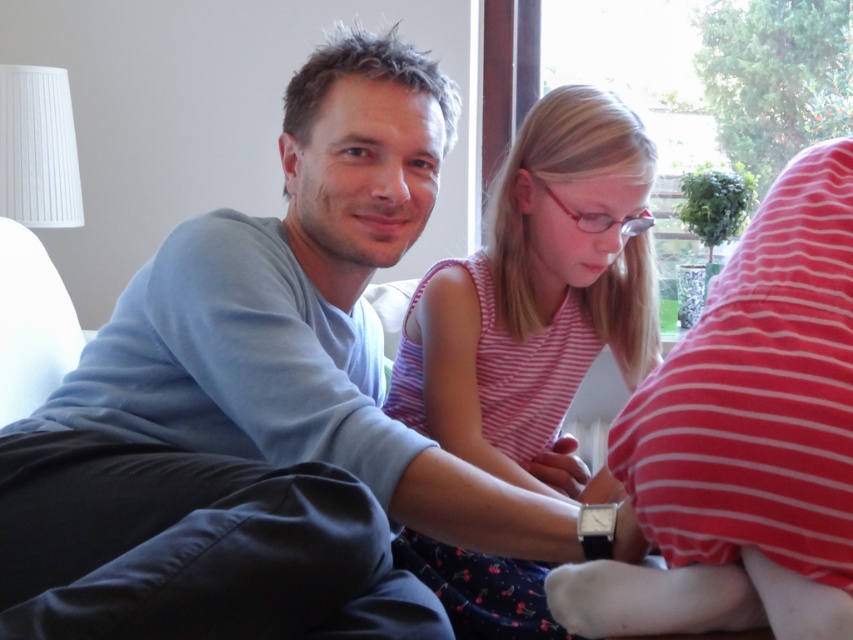
You are designing a seating arrangement for a photo shoot and need to place two models wearing the light blue sweater at center and the striped cotton shirt at center. Based on their clothing lengths, which model should sit closer to the edge of the couch to avoid their clothing dragging on the floor?

The light blue sweater at center is shorter than the striped cotton shirt at center, so the model wearing the striped cotton shirt at center should sit closer to the edge of the couch to avoid their longer clothing dragging on the floor.

You are designing a new seating arrangement for a waiting area and need to choose between two fabric samples for the couch covers. The options are a light blue sweater at center and a striped cotton shirt at center. Based on their sizes, which fabric sample would be more suitable if you want the couch to look more spacious?

The light blue sweater at center is larger in size than the striped cotton shirt at center, so using the light blue sweater at center fabric would make the couch appear more spacious due to its larger size.